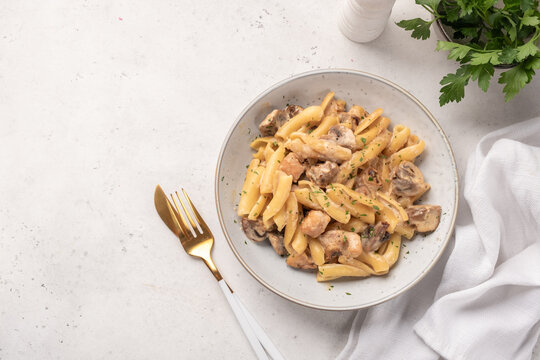
Where is `gold cutlery tips`? This screenshot has width=540, height=360. gold cutlery tips is located at coordinates (207, 250), (163, 207).